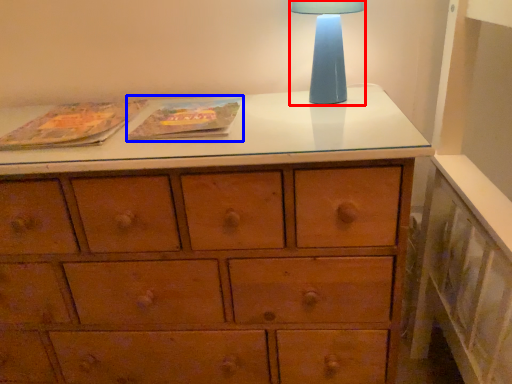
Question: Which object is closer to the camera taking this photo, table lamp (highlighted by a red box) or paperback book (highlighted by a blue box)?

Choices:
 (A) table lamp
 (B) paperback book

Answer: (B)